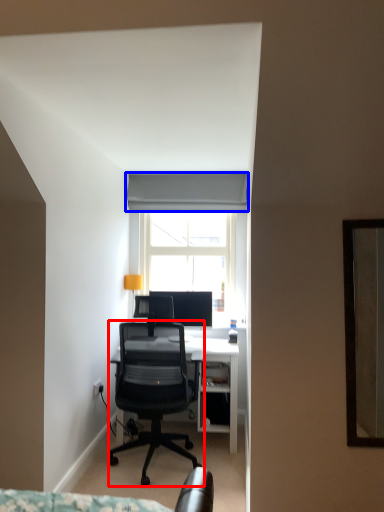
Question: Which point is further to the camera, chair (highlighted by a red box) or curtain (highlighted by a blue box)?

Choices:
 (A) chair
 (B) curtain

Answer: (B)